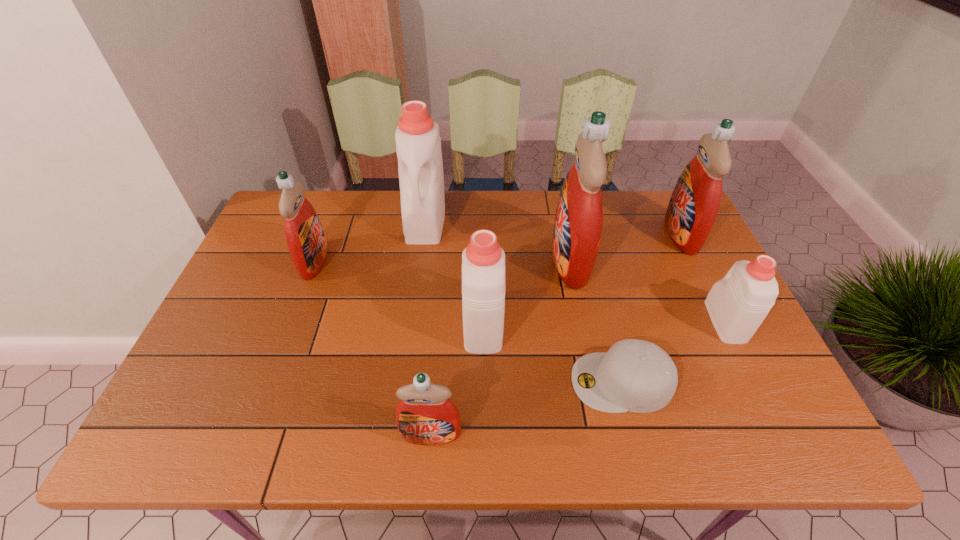
Locate an element on the screen. This screenshot has width=960, height=540. the tallest detergent is located at coordinates (577, 230).

Where is `the biggest red detergent`? the biggest red detergent is located at coordinates (577, 230).

Find the location of `the farthest white detergent`. the farthest white detergent is located at coordinates (418, 144).

Where is `the biggest white detergent`? This screenshot has height=540, width=960. the biggest white detergent is located at coordinates (418, 144).

Image resolution: width=960 pixels, height=540 pixels. I want to click on the second biggest red detergent, so click(694, 204).

Identify the location of the second smallest red detergent. This screenshot has height=540, width=960. (306, 242).

Image resolution: width=960 pixels, height=540 pixels. I want to click on the leftmost detergent, so click(306, 242).

The width and height of the screenshot is (960, 540). Find the location of `the second white detergent from left to right`. the second white detergent from left to right is located at coordinates (483, 261).

In order to click on the smallest white detergent in this screenshot , I will do `click(737, 304)`.

Identify the location of the nearest object. (425, 415).